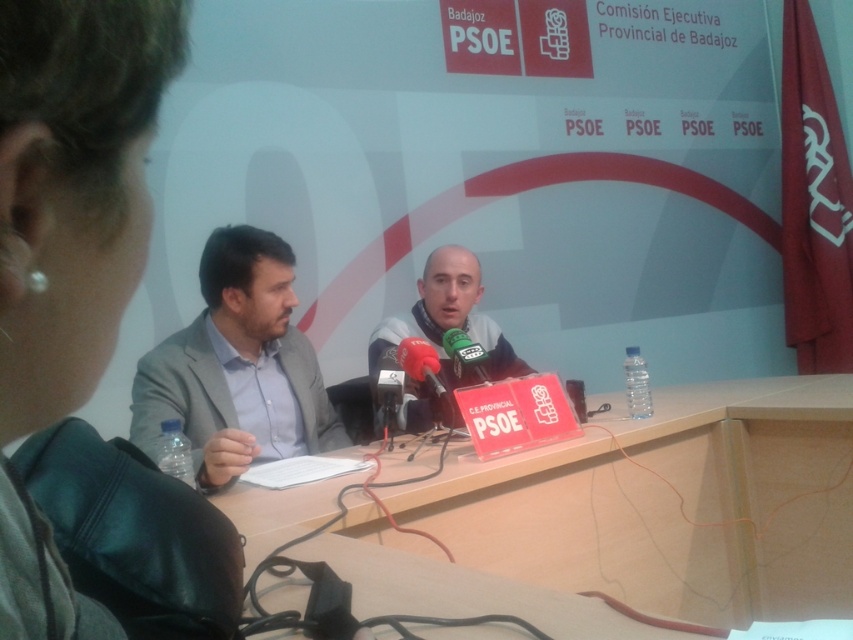
Does gray fabric suit at left have a lesser width compared to green matte microphone at center?

No, gray fabric suit at left is not thinner than green matte microphone at center.

Consider the image. Between gray fabric suit at left and green matte microphone at center, which one appears on the right side from the viewer's perspective?

Positioned to the right is green matte microphone at center.

Who is more distant from viewer, (x=277, y=300) or (x=479, y=349)?

The point (x=277, y=300) is behind.

The height and width of the screenshot is (640, 853). I want to click on gray fabric suit at left, so click(236, 365).

Where is `light brown wood table at center`? The image size is (853, 640). light brown wood table at center is located at coordinates (669, 502).

Does light brown wood table at center have a lesser width compared to gray fabric suit at left?

No, light brown wood table at center is not thinner than gray fabric suit at left.

I want to click on light brown wood table at center, so click(669, 502).

Looking at this image, can you confirm if matte black microphone at center is positioned below metallic red microphone at center?

Actually, matte black microphone at center is above metallic red microphone at center.

Does point (463, 248) lie in front of point (415, 349)?

That is False.

Identify the location of matte black microphone at center. (445, 321).